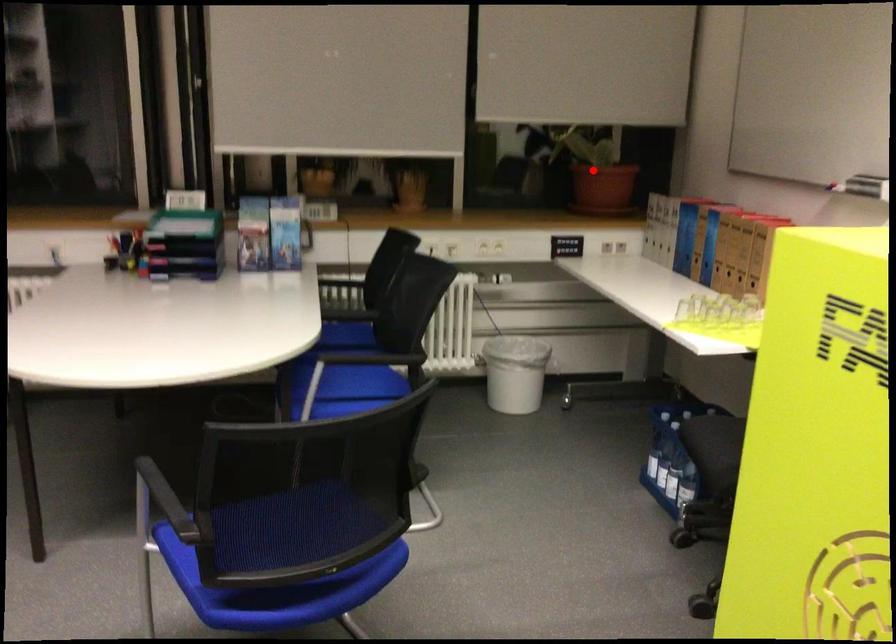
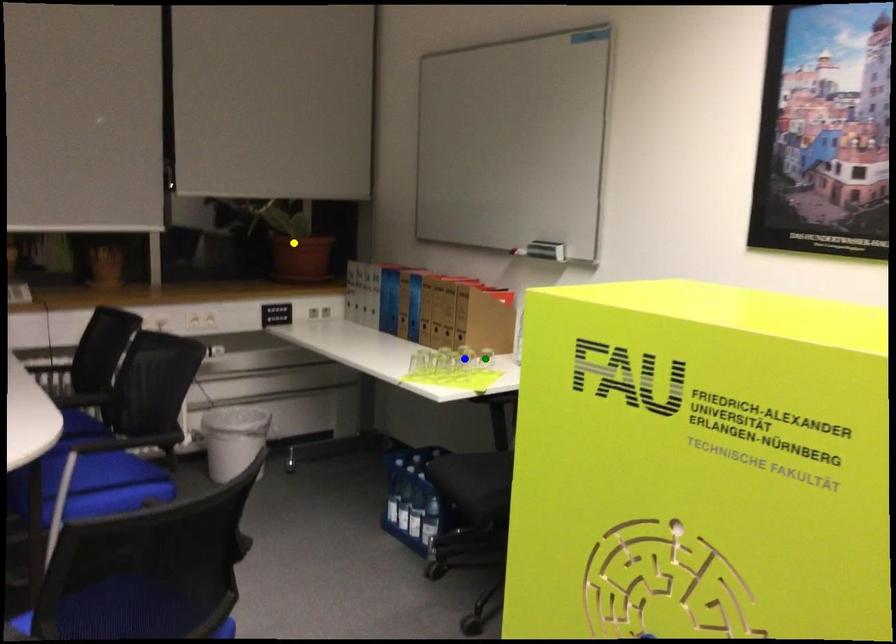
Question: I am providing you with two images of the same scene from different viewpoints. A red point is marked on the first image. You are given multiple points on the second image. Which point in image 2 is actually the same real-world point as the red point in image 1?

Choices:
 (A) green point
 (B) blue point
 (C) yellow point

Answer: (C)